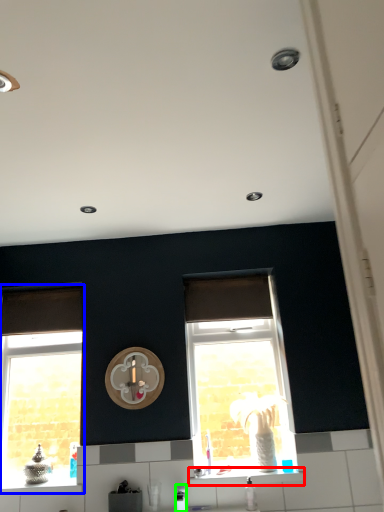
Question: Estimate the real-world distances between objects in this image. Which object is closer to window sill (highlighted by a red box), window (highlighted by a blue box) or appliance (highlighted by a green box)?

Choices:
 (A) window
 (B) appliance

Answer: (B)